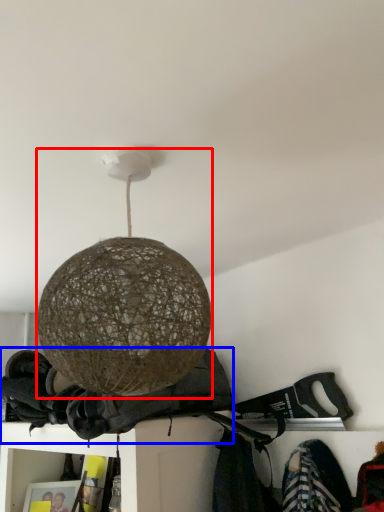
Question: Which object appears closest to the camera in this image, lamp (highlighted by a red box) or clothing (highlighted by a blue box)?

Choices:
 (A) lamp
 (B) clothing

Answer: (A)